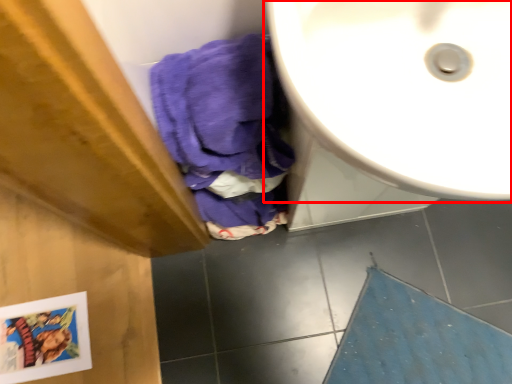
Question: From the image, what is the correct spatial relationship of sink (annotated by the red box) in relation to bath mat?

Choices:
 (A) left
 (B) right

Answer: (A)